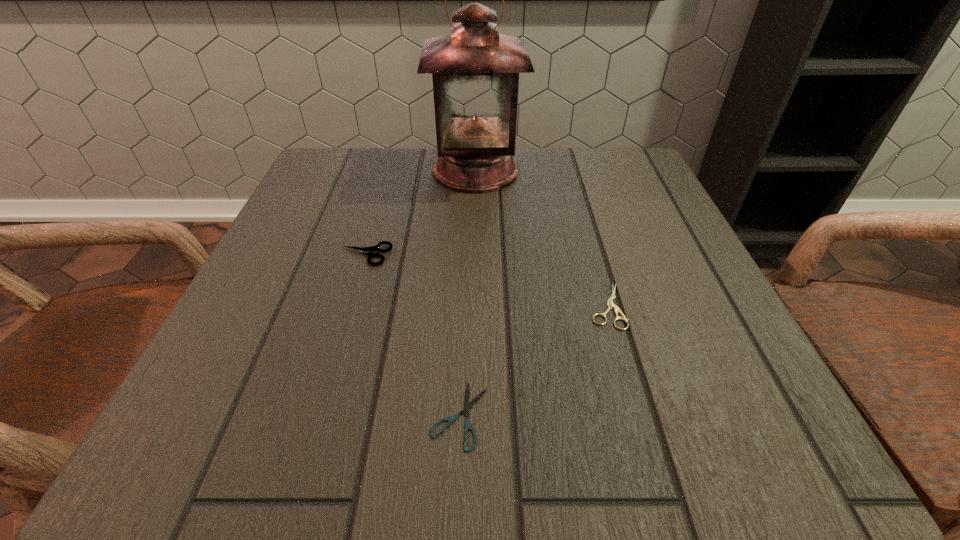
I want to click on the farthest object, so click(475, 70).

Locate an element on the screen. The height and width of the screenshot is (540, 960). the tallest object is located at coordinates (475, 70).

What are the coordinates of `the leftmost shears` in the screenshot? It's located at (368, 251).

Find the location of a particular element. the farthest shears is located at coordinates coord(368,251).

The width and height of the screenshot is (960, 540). I want to click on the rightmost object, so click(x=610, y=304).

This screenshot has width=960, height=540. I want to click on the third farthest object, so click(610, 304).

The height and width of the screenshot is (540, 960). I want to click on the nearest object, so [x=467, y=405].

This screenshot has height=540, width=960. In order to click on the second shears from left to right in this screenshot , I will do `click(467, 405)`.

I want to click on blank space located 0.180m on the left of the tallest object, so click(349, 170).

What are the coordinates of `free point located 0.360m on the right of the third shortest object` in the screenshot? It's located at (x=597, y=255).